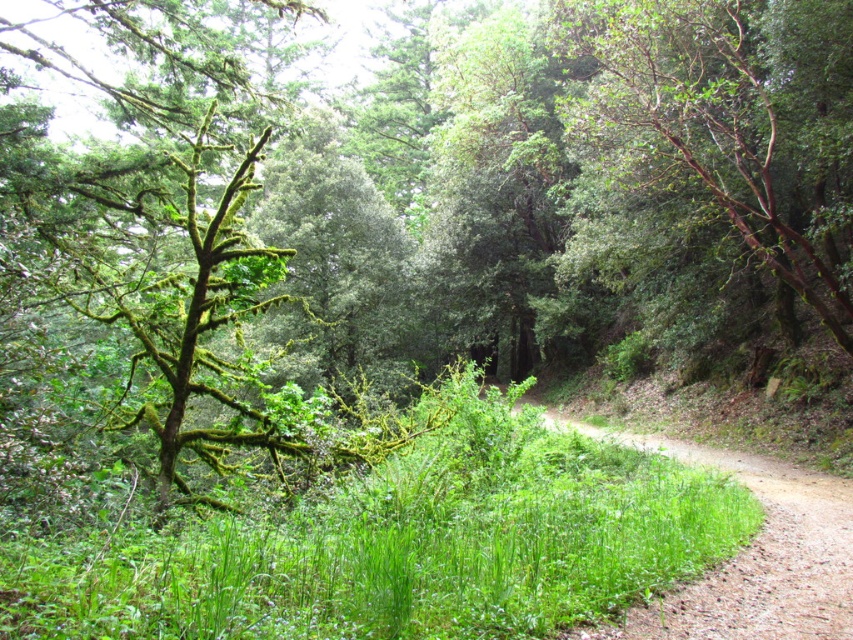
Question: Is green leafy grass at center positioned before dirt path at center?

Choices:
 (A) yes
 (B) no

Answer: (A)

Question: Which point is farther from the camera taking this photo?

Choices:
 (A) (415, 500)
 (B) (683, 460)
 (C) (743, 36)

Answer: (C)

Question: Does brown rough bark tree at upper right come in front of dirt path at center?

Choices:
 (A) no
 (B) yes

Answer: (A)

Question: Which of the following is the farthest from the observer?

Choices:
 (A) (770, 474)
 (B) (1, 576)
 (C) (846, 17)

Answer: (A)

Question: Is brown rough bark tree at upper right smaller than dirt path at center?

Choices:
 (A) no
 (B) yes

Answer: (A)

Question: Which object is closer to the camera taking this photo?

Choices:
 (A) dirt path at center
 (B) brown rough bark tree at upper right
 (C) green leafy grass at center

Answer: (C)